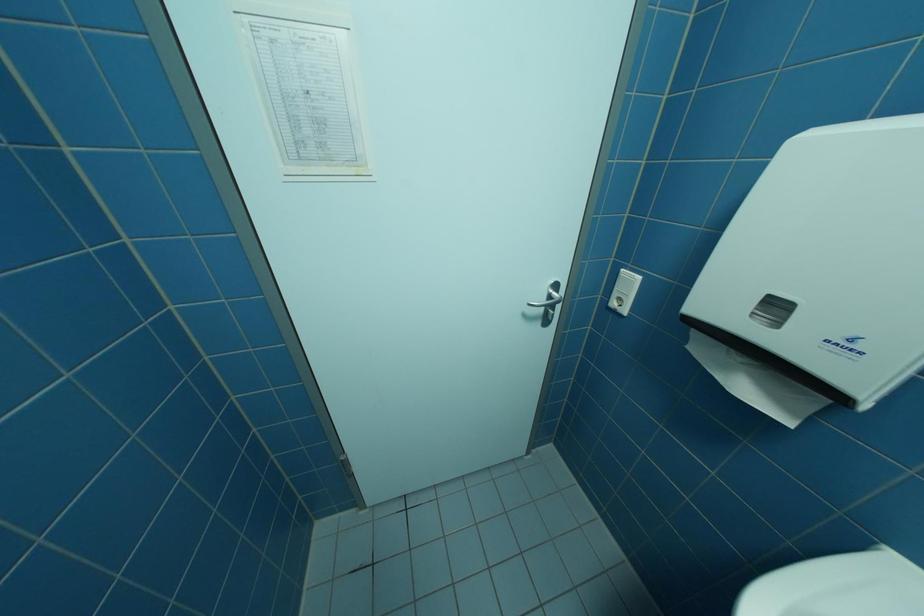
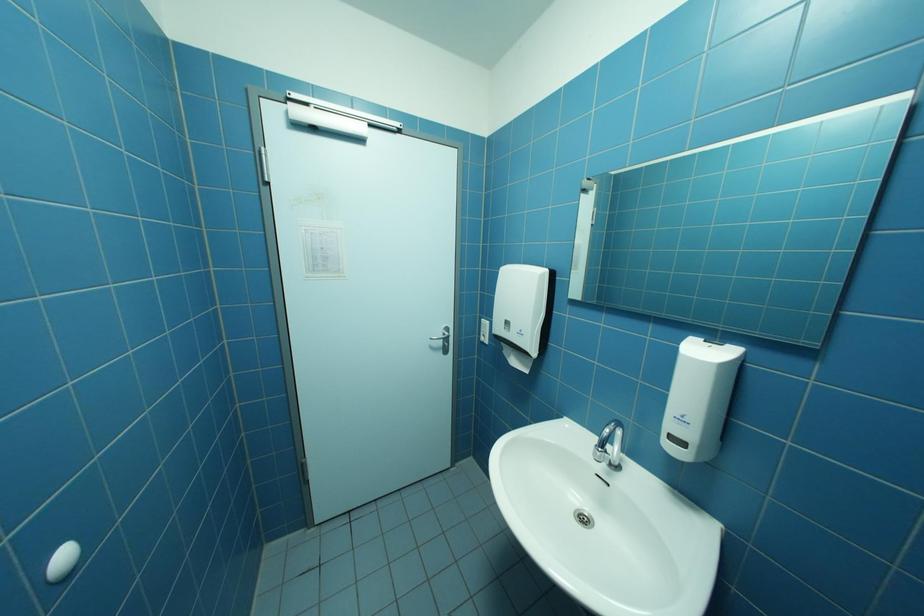
Question: The images are taken continuously from a first-person perspective. In which direction is your viewpoint rotating?

Choices:
 (A) Left
 (B) Right
 (C) Up
 (D) Down

Answer: (C)